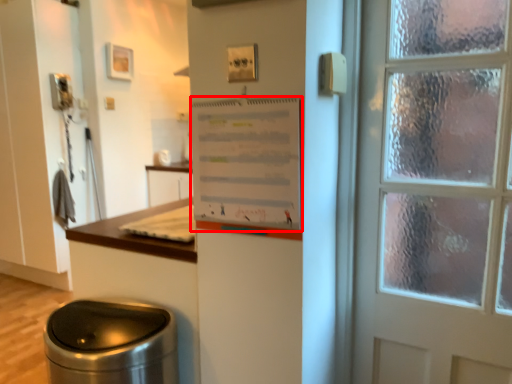
Question: From the image's perspective, where is poster (annotated by the red box) located relative to waste container?

Choices:
 (A) below
 (B) above

Answer: (B)